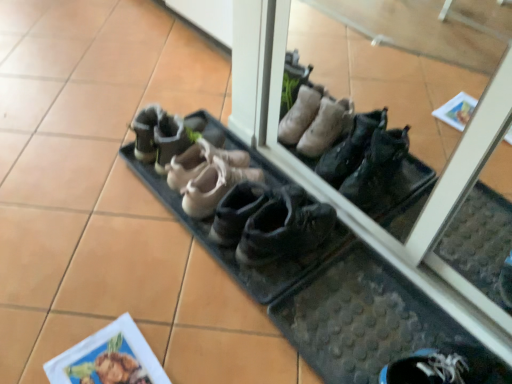
Question: Can we say brown suede shoes at center, marked as the third footwear in a right-to-left arrangement, lies outside matte paper at lower left?

Choices:
 (A) yes
 (B) no

Answer: (A)

Question: From the image's perspective, is brown suede shoes at center, acting as the second footwear starting from the left, located beneath matte paper at lower left?

Choices:
 (A) yes
 (B) no

Answer: (B)

Question: Is brown suede shoes at center, acting as the second footwear starting from the left, positioned before matte paper at lower left?

Choices:
 (A) yes
 (B) no

Answer: (B)

Question: Does brown suede shoes at center, acting as the second footwear starting from the left, have a lesser width compared to matte paper at lower left?

Choices:
 (A) no
 (B) yes

Answer: (A)

Question: Considering the relative positions of brown suede shoes at center, marked as the third footwear in a right-to-left arrangement, and matte paper at lower left in the image provided, is brown suede shoes at center, marked as the third footwear in a right-to-left arrangement, to the right of matte paper at lower left from the viewer's perspective?

Choices:
 (A) yes
 (B) no

Answer: (A)

Question: Could you tell me if brown suede shoes at center, marked as the third footwear in a right-to-left arrangement, is turned towards matte paper at lower left?

Choices:
 (A) no
 (B) yes

Answer: (B)

Question: Can you confirm if brown suede shoes at center, marked as the third footwear in a right-to-left arrangement, is thinner than leather shoes at center, which is counted as the second footwear, starting from the right?

Choices:
 (A) yes
 (B) no

Answer: (B)

Question: Considering the relative sizes of brown suede shoes at center, marked as the third footwear in a right-to-left arrangement, and leather shoes at center, the 3th footwear viewed from the left, in the image provided, is brown suede shoes at center, marked as the third footwear in a right-to-left arrangement, wider than leather shoes at center, the 3th footwear viewed from the left,?

Choices:
 (A) yes
 (B) no

Answer: (A)

Question: Is brown suede shoes at center, marked as the third footwear in a right-to-left arrangement, positioned before leather shoes at center, which is counted as the second footwear, starting from the right?

Choices:
 (A) yes
 (B) no

Answer: (A)

Question: From a real-world perspective, is brown suede shoes at center, acting as the second footwear starting from the left, located beneath leather shoes at center, the 3th footwear viewed from the left?

Choices:
 (A) yes
 (B) no

Answer: (A)

Question: Does brown suede shoes at center, marked as the third footwear in a right-to-left arrangement, come behind leather shoes at center, the 3th footwear viewed from the left?

Choices:
 (A) yes
 (B) no

Answer: (B)

Question: From a real-world perspective, does brown suede shoes at center, acting as the second footwear starting from the left, stand above leather shoes at center, which is counted as the second footwear, starting from the right?

Choices:
 (A) yes
 (B) no

Answer: (B)

Question: From the image's perspective, would you say black rubber boot at center, the 4th footwear when ordered from left to right, is positioned over matte paper at lower left?

Choices:
 (A) yes
 (B) no

Answer: (A)